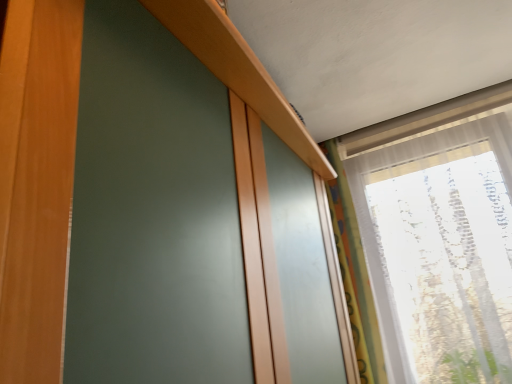
Question: Is multicolored fabric curtain at right taller than transparent fabric at upper right?

Choices:
 (A) yes
 (B) no

Answer: (B)

Question: Does multicolored fabric curtain at right have a lesser width compared to transparent fabric at upper right?

Choices:
 (A) no
 (B) yes

Answer: (B)

Question: From a real-world perspective, is multicolored fabric curtain at right beneath transparent fabric at upper right?

Choices:
 (A) yes
 (B) no

Answer: (B)

Question: Considering the relative positions of multicolored fabric curtain at right and transparent fabric at upper right in the image provided, is multicolored fabric curtain at right to the left of transparent fabric at upper right from the viewer's perspective?

Choices:
 (A) yes
 (B) no

Answer: (A)

Question: Does multicolored fabric curtain at right appear on the right side of transparent fabric at upper right?

Choices:
 (A) yes
 (B) no

Answer: (B)

Question: Is the depth of multicolored fabric curtain at right less than that of transparent fabric at upper right?

Choices:
 (A) yes
 (B) no

Answer: (B)

Question: Is transparent fabric at upper right not close to multicolored fabric curtain at right?

Choices:
 (A) yes
 (B) no

Answer: (B)

Question: Is the depth of transparent fabric at upper right greater than that of multicolored fabric curtain at right?

Choices:
 (A) yes
 (B) no

Answer: (B)

Question: Does transparent fabric at upper right have a larger size compared to multicolored fabric curtain at right?

Choices:
 (A) no
 (B) yes

Answer: (B)

Question: Is transparent fabric at upper right not within multicolored fabric curtain at right?

Choices:
 (A) no
 (B) yes

Answer: (B)

Question: Does transparent fabric at upper right have a lesser width compared to multicolored fabric curtain at right?

Choices:
 (A) no
 (B) yes

Answer: (A)

Question: Does transparent fabric at upper right appear on the left side of multicolored fabric curtain at right?

Choices:
 (A) yes
 (B) no

Answer: (B)

Question: From the image's perspective, relative to transparent fabric at upper right, is multicolored fabric curtain at right above or below?

Choices:
 (A) below
 (B) above

Answer: (A)